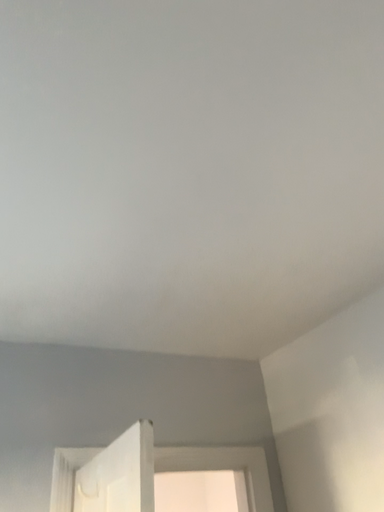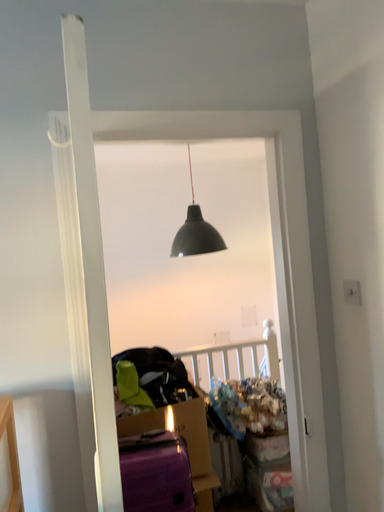
Question: Which way did the camera rotate in the video?

Choices:
 (A) rotated upward
 (B) rotated downward

Answer: (B)